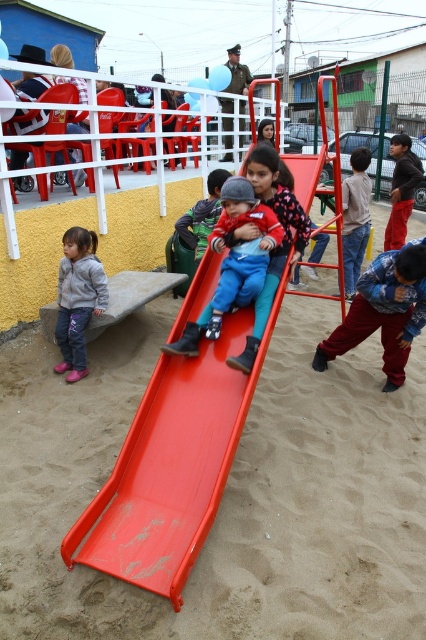
Question: Estimate the real-world distances between objects in this image. Which object is closer to the gray fleece jacket at lower left?

Choices:
 (A) smooth sand at center
 (B) blue fleece jacket at lower right

Answer: (A)

Question: Considering the real-world distances, which object is closest to the blue fleece jacket at lower right?

Choices:
 (A) gray fleece jacket at lower left
 (B) smooth plastic slide at center
 (C) matte blue pants at center
 (D) smooth blue pants at center

Answer: (C)

Question: Does blue fleece jacket at lower right come in front of matte blue pants at center?

Choices:
 (A) yes
 (B) no

Answer: (B)

Question: Which object appears farthest from the camera in this image?

Choices:
 (A) blue fleece jacket at lower right
 (B) smooth sand at center
 (C) matte blue pants at center
 (D) smooth blue pants at center

Answer: (D)

Question: Does smooth plastic slide at center appear on the left side of matte blue pants at center?

Choices:
 (A) yes
 (B) no

Answer: (A)

Question: Does smooth plastic slide at center appear under gray fleece jacket at lower left?

Choices:
 (A) yes
 (B) no

Answer: (A)